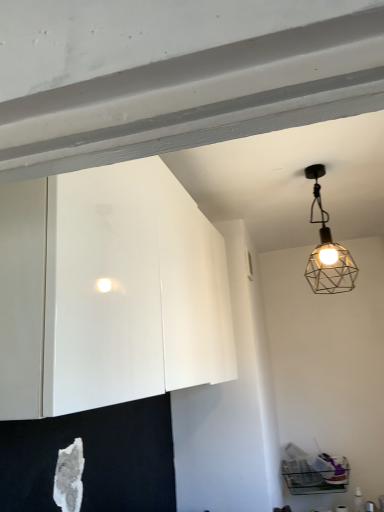
Describe the element at coordinates (109, 291) in the screenshot. I see `white glossy cabinet at upper left` at that location.

I want to click on white glossy cabinet at upper left, so click(x=109, y=291).

This screenshot has width=384, height=512. What do you see at coordinates (327, 250) in the screenshot?
I see `metallic wireframe lamp at upper right` at bounding box center [327, 250].

At what (x,y) coordinates should I click in order to perform the action: click on metallic wireframe lamp at upper right. Please return your answer as a coordinate pair (x, y). The width and height of the screenshot is (384, 512). Looking at the image, I should click on (327, 250).

Locate an element on the screen. white glossy cabinet at upper left is located at coordinates (109, 291).

Is metallic wireframe lamp at upper right to the left of white glossy cabinet at upper left from the viewer's perspective?

Incorrect, metallic wireframe lamp at upper right is not on the left side of white glossy cabinet at upper left.

Which object is further away from the camera, metallic wireframe lamp at upper right or white glossy cabinet at upper left?

metallic wireframe lamp at upper right is further away from the camera.

Is point (346, 279) behind point (21, 357)?

Yes, it is behind point (21, 357).

From the image's perspective, is metallic wireframe lamp at upper right above white glossy cabinet at upper left?

Indeed, from the image's perspective, metallic wireframe lamp at upper right is shown above white glossy cabinet at upper left.

From a real-world perspective, is metallic wireframe lamp at upper right located higher than white glossy cabinet at upper left?

Yes, from a real-world perspective, metallic wireframe lamp at upper right is on top of white glossy cabinet at upper left.

Between metallic wireframe lamp at upper right and white glossy cabinet at upper left, which one has larger width?

white glossy cabinet at upper left.

Is metallic wireframe lamp at upper right taller than white glossy cabinet at upper left?

No.

Who is bigger, metallic wireframe lamp at upper right or white glossy cabinet at upper left?

With larger size is white glossy cabinet at upper left.

Is metallic wireframe lamp at upper right not inside white glossy cabinet at upper left?

Yes.

In the scene shown: Is metallic wireframe lamp at upper right in contact with white glossy cabinet at upper left?

metallic wireframe lamp at upper right and white glossy cabinet at upper left are not in contact.

Is metallic wireframe lamp at upper right oriented towards white glossy cabinet at upper left?

No, metallic wireframe lamp at upper right does not turn towards white glossy cabinet at upper left.

Can you tell me how much metallic wireframe lamp at upper right and white glossy cabinet at upper left differ in facing direction?

They differ by 89 degrees in their facing directions.

Measure the distance between metallic wireframe lamp at upper right and white glossy cabinet at upper left.

1.00 meters.

This screenshot has height=512, width=384. What are the coordinates of `lamp located above the white glossy cabinet at upper left (from the image's perspective)` in the screenshot? It's located at (327, 250).

Which is more to the right, white glossy cabinet at upper left or metallic wireframe lamp at upper right?

metallic wireframe lamp at upper right.

Considering their positions, is white glossy cabinet at upper left located in front of or behind metallic wireframe lamp at upper right?

white glossy cabinet at upper left is positioned closer to the viewer than metallic wireframe lamp at upper right.

Is point (21, 260) positioned before point (342, 257)?

Yes, point (21, 260) is closer to viewer.

From the image's perspective, which one is positioned higher, white glossy cabinet at upper left or metallic wireframe lamp at upper right?

metallic wireframe lamp at upper right appears higher in the image.

From a real-world perspective, is white glossy cabinet at upper left physically located above or below metallic wireframe lamp at upper right?

Clearly, from a real-world perspective, white glossy cabinet at upper left is below metallic wireframe lamp at upper right.

Considering the sizes of objects white glossy cabinet at upper left and metallic wireframe lamp at upper right in the image provided, who is wider, white glossy cabinet at upper left or metallic wireframe lamp at upper right?

white glossy cabinet at upper left.

Does white glossy cabinet at upper left have a lesser height compared to metallic wireframe lamp at upper right?

No.

Considering the relative sizes of white glossy cabinet at upper left and metallic wireframe lamp at upper right in the image provided, is white glossy cabinet at upper left bigger than metallic wireframe lamp at upper right?

Yes, white glossy cabinet at upper left is bigger than metallic wireframe lamp at upper right.

Is metallic wireframe lamp at upper right surrounded by white glossy cabinet at upper left?

No, white glossy cabinet at upper left does not contain metallic wireframe lamp at upper right.

Can you see white glossy cabinet at upper left touching metallic wireframe lamp at upper right?

No.

Is metallic wireframe lamp at upper right at the back of white glossy cabinet at upper left?

No, white glossy cabinet at upper left is not facing away from metallic wireframe lamp at upper right.

Find the location of `lamp located behind the white glossy cabinet at upper left`. lamp located behind the white glossy cabinet at upper left is located at coordinates pos(327,250).

Where is `cabinetry that is on the left side of metallic wireframe lamp at upper right`? cabinetry that is on the left side of metallic wireframe lamp at upper right is located at coordinates (109, 291).

Locate an element on the screen. The height and width of the screenshot is (512, 384). lamp above the white glossy cabinet at upper left (from a real-world perspective) is located at coordinates (327, 250).